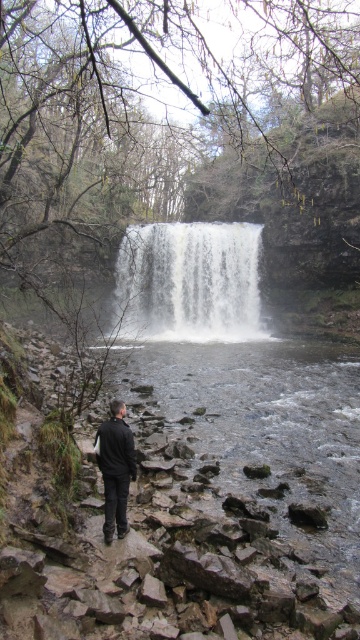
Question: Does white textured water at center appear on the right side of black matte jacket at center?

Choices:
 (A) no
 (B) yes

Answer: (B)

Question: Can you confirm if white textured water at center is positioned to the right of black matte jacket at center?

Choices:
 (A) yes
 (B) no

Answer: (A)

Question: From the image, what is the correct spatial relationship of white textured water at center in relation to black matte jacket at center?

Choices:
 (A) above
 (B) below

Answer: (A)

Question: Which object appears farthest from the camera in this image?

Choices:
 (A) white textured water at center
 (B) black matte jacket at center

Answer: (A)

Question: Which of the following is the farthest from the observer?

Choices:
 (A) white textured water at center
 (B) black matte jacket at center

Answer: (A)